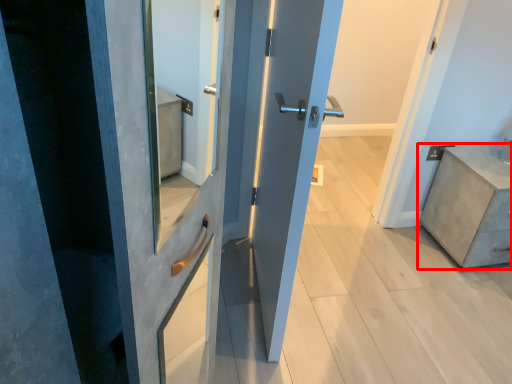
Question: From the image's perspective, considering the relative positions of chest of drawers (annotated by the red box) and door in the image provided, where is chest of drawers (annotated by the red box) located with respect to the staircase?

Choices:
 (A) above
 (B) below

Answer: (B)